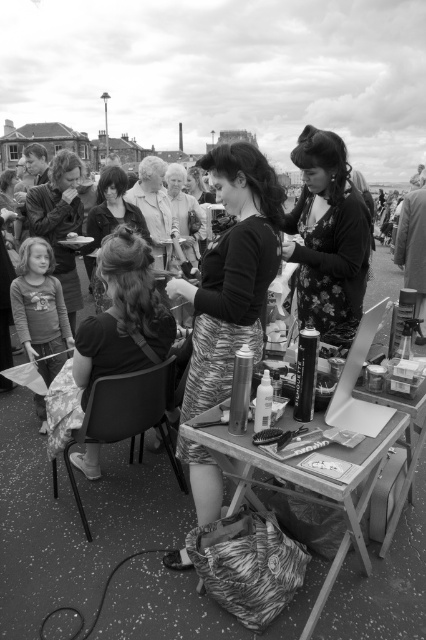
Question: Which object is farther from the camera taking this photo?

Choices:
 (A) floral fabric dress at center
 (B) matte black shirt at center
 (C) matte black hair spray at center
 (D) matte gray sweater at center

Answer: (D)

Question: Which point is farther to the camera?

Choices:
 (A) (322, 308)
 (B) (210, 396)

Answer: (A)

Question: Is floral fabric dress at center below matte black jacket at center?

Choices:
 (A) yes
 (B) no

Answer: (A)

Question: Observing the image, what is the correct spatial positioning of matte black hair spray at center in reference to matte black jacket at center?

Choices:
 (A) left
 (B) right

Answer: (B)

Question: Which point is closer to the camera?

Choices:
 (A) (78, 216)
 (B) (103, 173)
 (C) (316, 483)
 (D) (180, 177)

Answer: (C)

Question: Can you confirm if matte white jacket at center is positioned to the left of matte gray sweater at center?

Choices:
 (A) no
 (B) yes

Answer: (B)